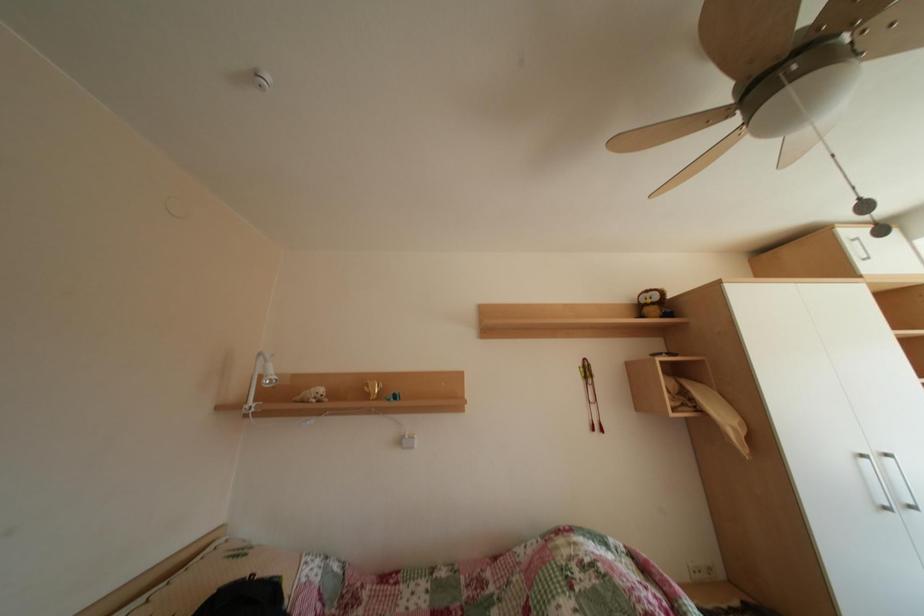
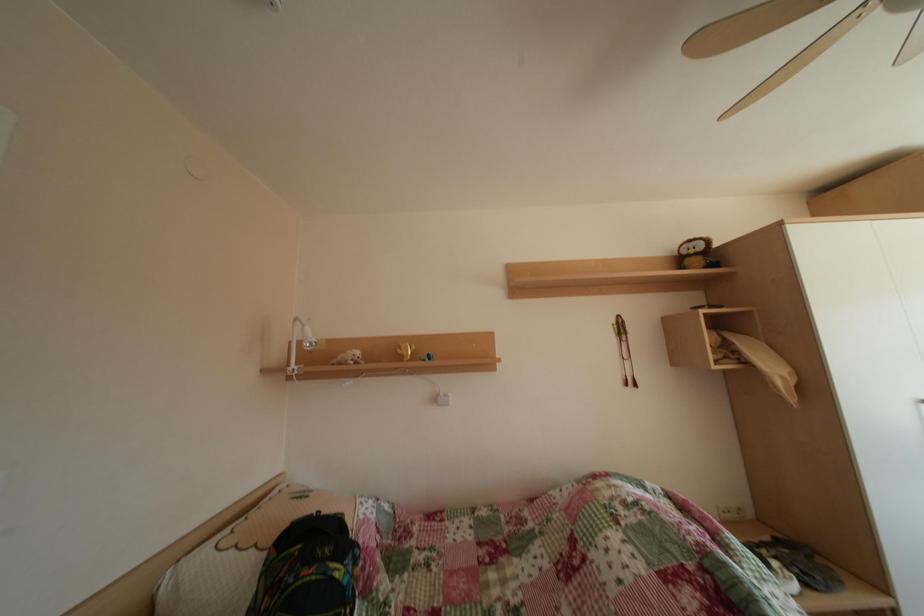
Question: The images are taken continuously from a first-person perspective. In which direction is your viewpoint rotating?

Choices:
 (A) Left
 (B) Right
 (C) Up
 (D) Down

Answer: (D)